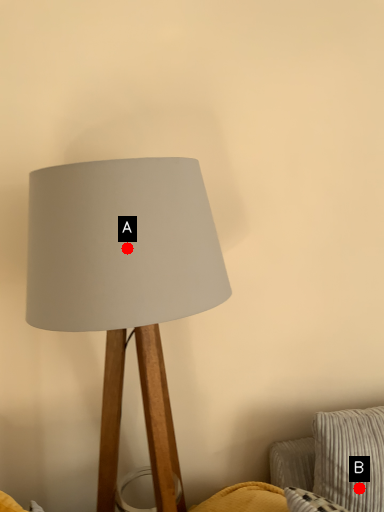
Question: Two points are circled on the image, labeled by A and B beside each circle. Which point appears closest to the camera in this image?

Choices:
 (A) A is closer
 (B) B is closer

Answer: (A)